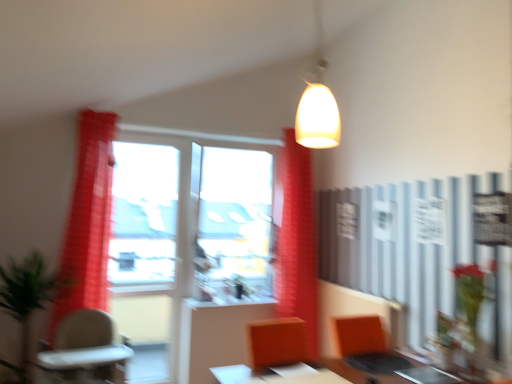
Question: Does green matte plant at center, marked as the 2th plant in a front-to-back arrangement, lie behind orange fabric armchair at lower right?

Choices:
 (A) yes
 (B) no

Answer: (A)

Question: Is green matte plant at center, which is the 1th plant from right to left, far from orange fabric armchair at lower right?

Choices:
 (A) yes
 (B) no

Answer: (A)

Question: Does green matte plant at center, which is the 2th plant in left-to-right order, have a lesser width compared to orange fabric armchair at lower right?

Choices:
 (A) no
 (B) yes

Answer: (B)

Question: Would you say orange fabric armchair at lower right is part of green matte plant at center, which is the 1th plant from right to left,'s contents?

Choices:
 (A) yes
 (B) no

Answer: (B)

Question: Is green matte plant at center, which is the 2th plant in left-to-right order, at the right side of orange fabric armchair at lower right?

Choices:
 (A) yes
 (B) no

Answer: (B)

Question: Is the position of green matte plant at center, which is the first plant in back-to-front order, less distant than that of orange fabric armchair at lower right?

Choices:
 (A) yes
 (B) no

Answer: (B)

Question: Is orange fabric armchair at lower right thinner than green matte plant at center, marked as the 2th plant in a front-to-back arrangement?

Choices:
 (A) yes
 (B) no

Answer: (B)

Question: Is orange fabric armchair at lower right located outside green matte plant at center, which is the 1th plant from right to left?

Choices:
 (A) no
 (B) yes

Answer: (B)

Question: Considering the relative sizes of orange fabric armchair at lower right and green matte plant at center, which is the 1th plant from right to left, in the image provided, is orange fabric armchair at lower right bigger than green matte plant at center, which is the 1th plant from right to left,?

Choices:
 (A) no
 (B) yes

Answer: (B)

Question: From a real-world perspective, is orange fabric armchair at lower right positioned under green matte plant at center, which is the 2th plant in left-to-right order, based on gravity?

Choices:
 (A) yes
 (B) no

Answer: (A)

Question: Is green matte plant at center, which is the 1th plant from right to left, inside orange fabric armchair at lower right?

Choices:
 (A) yes
 (B) no

Answer: (B)

Question: From a real-world perspective, is orange fabric armchair at lower right over green matte plant at center, marked as the 2th plant in a front-to-back arrangement?

Choices:
 (A) yes
 (B) no

Answer: (B)

Question: Is red sheer curtain at left, marked as the 1th curtain in a left-to-right arrangement, not close to beige plastic chair at lower left?

Choices:
 (A) yes
 (B) no

Answer: (B)